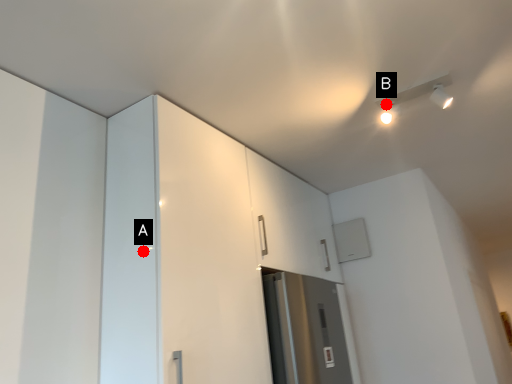
Question: Two points are circled on the image, labeled by A and B beside each circle. Which point is farther from the camera taking this photo?

Choices:
 (A) A is further
 (B) B is further

Answer: (B)